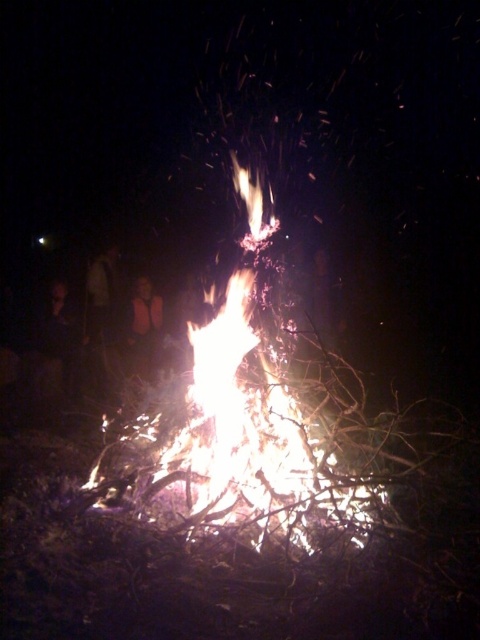
Does bright orange flames at center have a greater height compared to dark fabric shirt at left?

Correct, bright orange flames at center is much taller as dark fabric shirt at left.

The image size is (480, 640). Describe the element at coordinates (252, 436) in the screenshot. I see `bright orange flames at center` at that location.

Is point (259, 484) positioned in front of point (96, 296)?

Yes, it is.

Where is `bright orange flames at center`? Image resolution: width=480 pixels, height=640 pixels. bright orange flames at center is located at coordinates (252, 436).

Which is behind, point (133, 349) or point (104, 252)?

The point (104, 252) is behind.

Can you confirm if orange vest at center is taller than dark fabric shirt at left?

In fact, orange vest at center may be shorter than dark fabric shirt at left.

Between point (134, 358) and point (109, 250), which one is positioned in front?

Point (134, 358) is in front.

Locate an element on the screen. The height and width of the screenshot is (640, 480). orange vest at center is located at coordinates (142, 330).

Between bright orange flames at center and orange vest at center, which one has more height?

Standing taller between the two is bright orange flames at center.

Is point (245, 392) positioned behind point (151, 353)?

No.

At what (x,y) coordinates should I click in order to perform the action: click on bright orange flames at center. Please return your answer as a coordinate pair (x, y). Looking at the image, I should click on (252, 436).